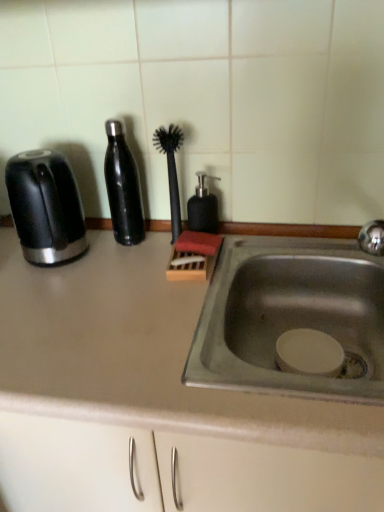
Question: Can you confirm if satin black bottle at center left is positioned to the right of black matte soap dispenser at center?

Choices:
 (A) no
 (B) yes

Answer: (A)

Question: Is satin black bottle at center left thinner than black matte soap dispenser at center?

Choices:
 (A) no
 (B) yes

Answer: (A)

Question: From the image's perspective, is satin black bottle at center left located beneath black matte soap dispenser at center?

Choices:
 (A) no
 (B) yes

Answer: (A)

Question: From a real-world perspective, does satin black bottle at center left stand above black matte soap dispenser at center?

Choices:
 (A) yes
 (B) no

Answer: (A)

Question: From a real-world perspective, does satin black bottle at center left sit lower than black matte soap dispenser at center?

Choices:
 (A) no
 (B) yes

Answer: (A)

Question: Is satin black bottle at center left facing towards black matte soap dispenser at center?

Choices:
 (A) yes
 (B) no

Answer: (B)

Question: Is black rubber brush at center positioned with its back to satin black bottle at center left?

Choices:
 (A) no
 (B) yes

Answer: (A)

Question: Does black rubber brush at center contain satin black bottle at center left?

Choices:
 (A) yes
 (B) no

Answer: (B)

Question: Is black rubber brush at center thinner than satin black bottle at center left?

Choices:
 (A) no
 (B) yes

Answer: (B)

Question: Considering the relative positions of black rubber brush at center and satin black bottle at center left in the image provided, is black rubber brush at center to the left of satin black bottle at center left from the viewer's perspective?

Choices:
 (A) no
 (B) yes

Answer: (A)

Question: Can you confirm if black rubber brush at center is taller than satin black bottle at center left?

Choices:
 (A) yes
 (B) no

Answer: (B)

Question: Is the position of black rubber brush at center less distant than that of satin black bottle at center left?

Choices:
 (A) yes
 (B) no

Answer: (B)

Question: From a real-world perspective, does black glossy toaster at left stand above satin black bottle at center left?

Choices:
 (A) yes
 (B) no

Answer: (B)